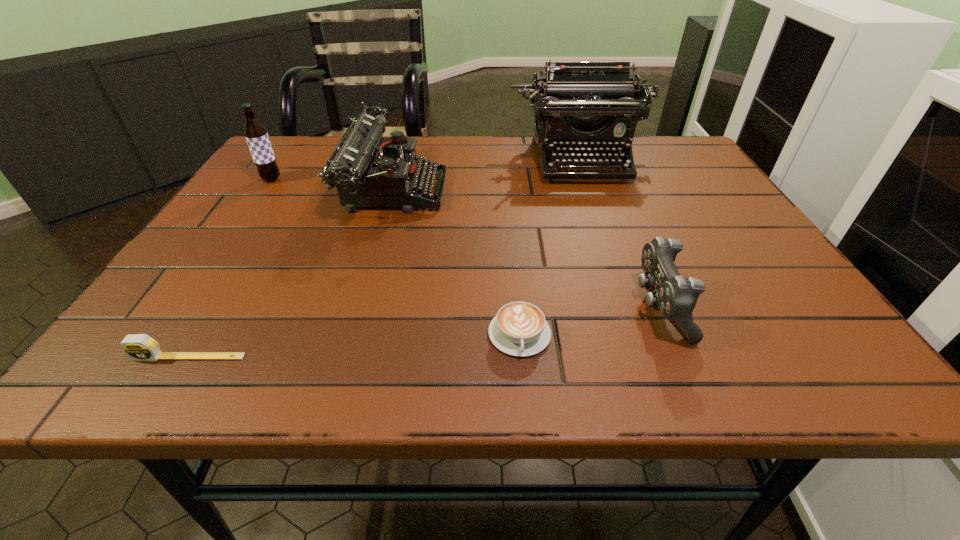
Locate an element on the screen. object that is the second closest to the fourth shortest object is located at coordinates (594, 106).

This screenshot has width=960, height=540. Find the location of `vacant point that satisfies the following two spatial constraints: 1. on the surface of the fourth tallest object with buttons; 2. at the front of the tape measure with the tape extended`. vacant point that satisfies the following two spatial constraints: 1. on the surface of the fourth tallest object with buttons; 2. at the front of the tape measure with the tape extended is located at coordinates (680, 357).